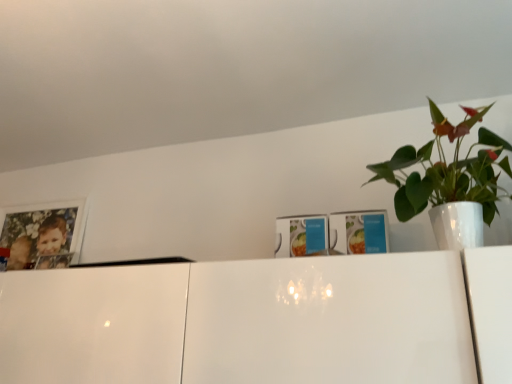
Question: Does green glossy plant at upper right come behind wooden photo frame at upper left?

Choices:
 (A) no
 (B) yes

Answer: (A)

Question: Is green glossy plant at upper right oriented away from wooden photo frame at upper left?

Choices:
 (A) no
 (B) yes

Answer: (A)

Question: Does green glossy plant at upper right have a greater height compared to wooden photo frame at upper left?

Choices:
 (A) no
 (B) yes

Answer: (B)

Question: Considering the relative sizes of green glossy plant at upper right and wooden photo frame at upper left in the image provided, is green glossy plant at upper right bigger than wooden photo frame at upper left?

Choices:
 (A) yes
 (B) no

Answer: (A)

Question: Is green glossy plant at upper right not inside wooden photo frame at upper left?

Choices:
 (A) no
 (B) yes

Answer: (B)

Question: Are green glossy plant at upper right and wooden photo frame at upper left making contact?

Choices:
 (A) no
 (B) yes

Answer: (A)

Question: Can green glossy plant at upper right be found inside wooden photo frame at upper left?

Choices:
 (A) no
 (B) yes

Answer: (A)

Question: Is wooden photo frame at upper left positioned far away from green glossy plant at upper right?

Choices:
 (A) no
 (B) yes

Answer: (B)

Question: From the image's perspective, does wooden photo frame at upper left appear higher than green glossy plant at upper right?

Choices:
 (A) no
 (B) yes

Answer: (A)

Question: Could you tell me if wooden photo frame at upper left is turned towards green glossy plant at upper right?

Choices:
 (A) yes
 (B) no

Answer: (B)

Question: Is wooden photo frame at upper left looking in the opposite direction of green glossy plant at upper right?

Choices:
 (A) yes
 (B) no

Answer: (B)

Question: Would you say wooden photo frame at upper left is outside green glossy plant at upper right?

Choices:
 (A) yes
 (B) no

Answer: (A)

Question: Considering the positions of green glossy plant at upper right and wooden photo frame at upper left in the image, is green glossy plant at upper right bigger or smaller than wooden photo frame at upper left?

Choices:
 (A) small
 (B) big

Answer: (B)